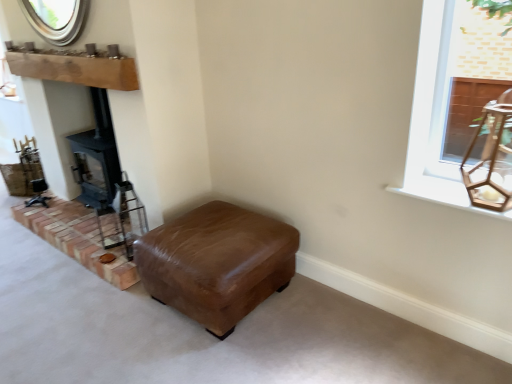
In order to click on free space above white wood window sill at upper right (from a real-world perspective) in this screenshot , I will do `click(447, 183)`.